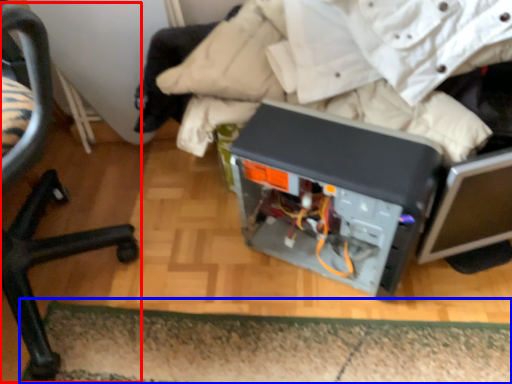
Question: Which point is further to the camera, chair (highlighted by a red box) or doormat (highlighted by a blue box)?

Choices:
 (A) chair
 (B) doormat

Answer: (B)